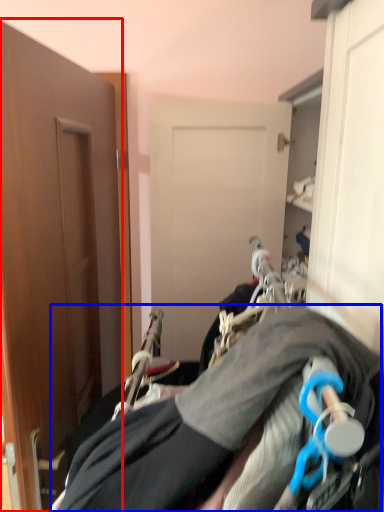
Question: Which object is further to the camera taking this photo, door (highlighted by a red box) or couple (highlighted by a blue box)?

Choices:
 (A) door
 (B) couple

Answer: (A)